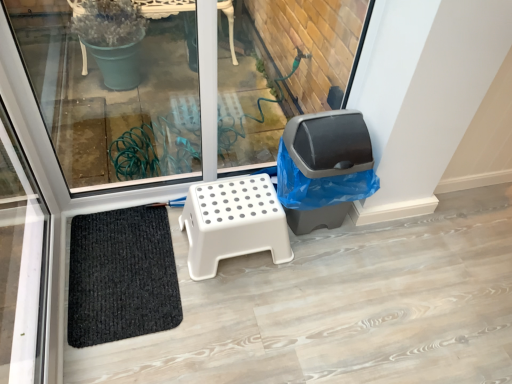
Locate an element on the screen. This screenshot has width=512, height=384. vacant region in front of transparent glass window at center is located at coordinates (236, 324).